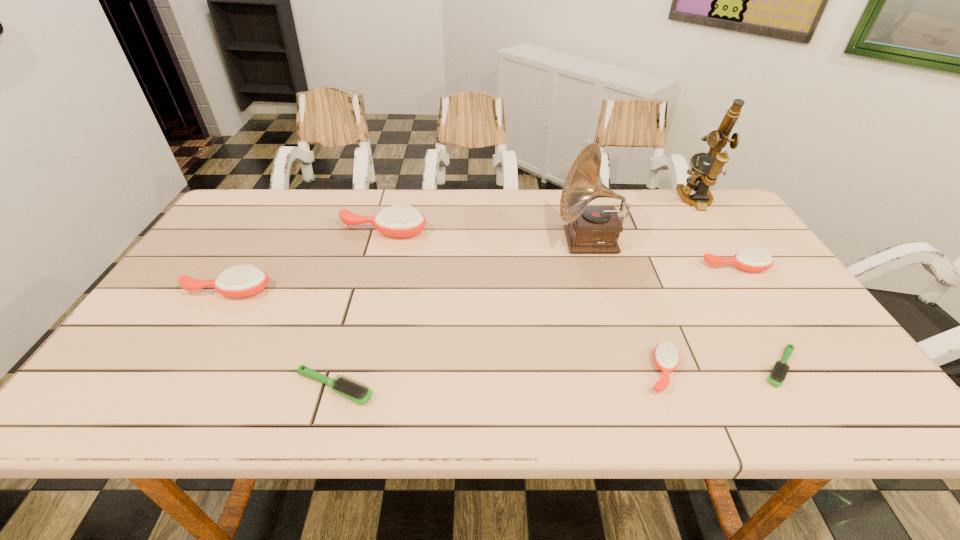
Locate an element on the screen. This screenshot has width=960, height=540. microscope is located at coordinates (703, 176).

Find the location of a particular element. This screenshot has height=540, width=960. phonograph record is located at coordinates point(591,229).

The width and height of the screenshot is (960, 540). I want to click on brown phonograph record, so click(x=591, y=229).

At what (x,y) coordinates should I click in order to perform the action: click on the farthest hairbrush. Please return your answer as a coordinate pair (x, y). Looking at the image, I should click on (397, 221).

Identify the location of the second orange hairbrush from left to right. This screenshot has height=540, width=960. (397, 221).

Identify the location of the leftmost object. This screenshot has width=960, height=540. (240, 281).

The height and width of the screenshot is (540, 960). I want to click on the fifth farthest object, so click(240, 281).

Where is `the fifth tallest object`? This screenshot has height=540, width=960. the fifth tallest object is located at coordinates (754, 260).

What are the coordinates of `the third tallest hairbrush` in the screenshot? It's located at (754, 260).

Locate an element on the screen. the smallest orange hairbrush is located at coordinates (666, 357).